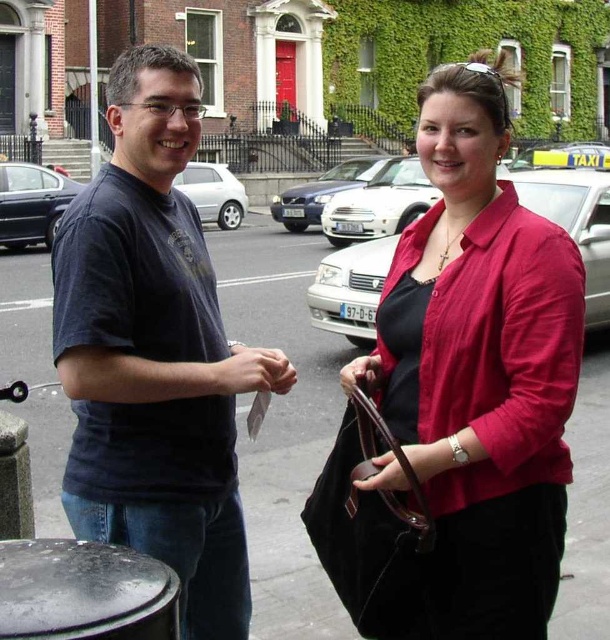
You are a photographer trying to capture a closeup of the matte pink blouse at center and the leather handbag at lower center. Since you want both items to be in focus, which one should you focus on first to ensure the other is sharp?

The matte pink blouse at center is taller than the leather handbag at lower center. To ensure both are in focus, you should focus on the matte pink blouse at center first because it is larger in the frame, allowing the depth of field to cover the smaller leather handbag at lower center.